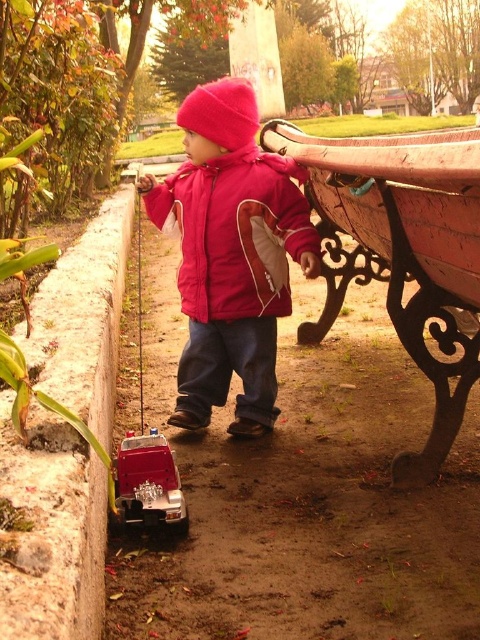
Question: Which of the following is the closest to the observer?

Choices:
 (A) matte pink jacket at center
 (B) matte red jacket at center
 (C) metallic red toy car at lower left

Answer: (C)

Question: Which point is farther to the camera?

Choices:
 (A) metallic red toy car at lower left
 (B) matte pink jacket at center
 (C) rustic wood bench at right
 (D) matte red jacket at center

Answer: (D)

Question: Does rustic wood bench at right have a smaller size compared to matte red jacket at center?

Choices:
 (A) yes
 (B) no

Answer: (B)

Question: Does matte pink jacket at center appear on the right side of matte red jacket at center?

Choices:
 (A) yes
 (B) no

Answer: (A)

Question: Which point is closer to the camera taking this photo?

Choices:
 (A) (160, 442)
 (B) (478, 218)

Answer: (B)

Question: Does matte red jacket at center have a larger size compared to metallic red toy car at lower left?

Choices:
 (A) no
 (B) yes

Answer: (B)